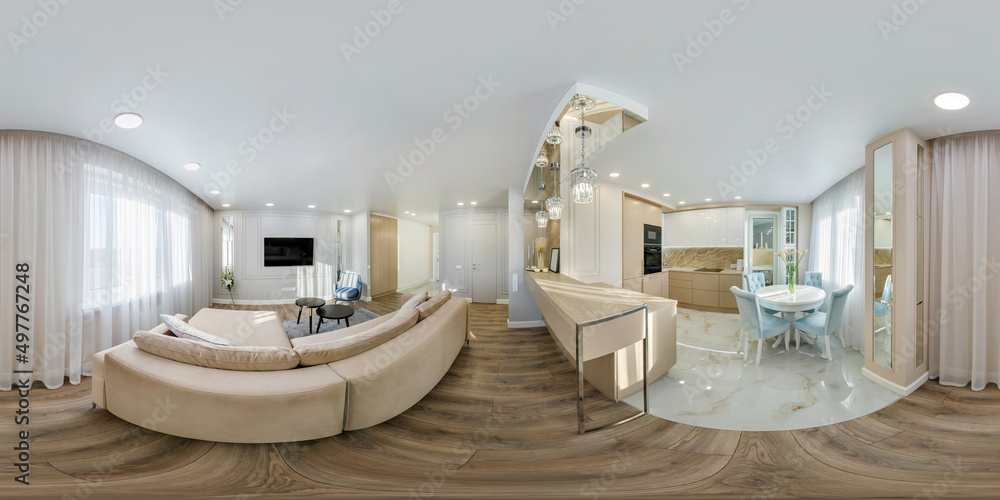
In order to click on table in this screenshot , I will do `click(302, 305)`, `click(332, 309)`, `click(793, 299)`.